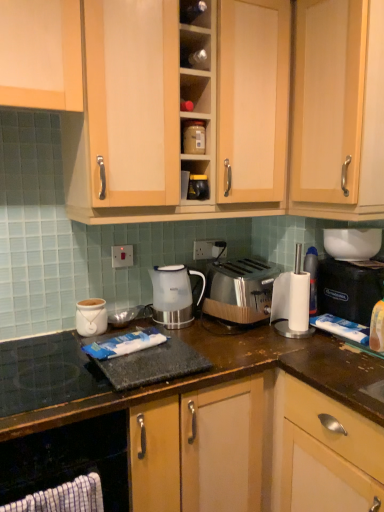
Describe the element at coordinates (69, 459) in the screenshot. I see `black rubber mat at lower left` at that location.

The image size is (384, 512). In order to click on white glossy bowl at upper right, the third appliance viewed from the top in this screenshot , I will do `click(352, 243)`.

The height and width of the screenshot is (512, 384). Describe the element at coordinates (46, 373) in the screenshot. I see `black glass gas stove at lower left` at that location.

How much space does white ceramic jar at center, the fourth appliance when ordered from top to bottom, occupy horizontally?

white ceramic jar at center, the fourth appliance when ordered from top to bottom, is 5.38 inches in width.

In order to face light wood cabinet at upper center, which is the third cabinetry from bottom to top, should I rotate leftwards or rightwards?

You should look left and rotate roughly 1.237 degrees.

The width and height of the screenshot is (384, 512). Describe the element at coordinates (217, 103) in the screenshot. I see `light wood cabinet at upper center, which is the third cabinetry from bottom to top` at that location.

Measure the distance between point (116, 255) and camera.

The depth of point (116, 255) is 5.51 feet.

I want to click on matte plastic container at upper center, the 3th appliance when ordered from right to left, so [x=194, y=137].

Does matte plastic container at upper center, marked as the fourth appliance in a bottom-to-top arrangement, touch black glass gas stove at lower left?

No, matte plastic container at upper center, marked as the fourth appliance in a bottom-to-top arrangement, is not making contact with black glass gas stove at lower left.

Is matte plastic container at upper center, the 3th appliance when ordered from right to left, at the right side of black glass gas stove at lower left?

Indeed, matte plastic container at upper center, the 3th appliance when ordered from right to left, is positioned on the right side of black glass gas stove at lower left.

From a real-world perspective, between matte plastic container at upper center, positioned as the first appliance in top-to-bottom order, and black glass gas stove at lower left, who is vertically lower?

From a 3D spatial view, black glass gas stove at lower left is below.

From the picture: Does matte plastic container at upper center, marked as the fourth appliance in a bottom-to-top arrangement, have a greater width compared to black glass gas stove at lower left?

Incorrect, the width of matte plastic container at upper center, marked as the fourth appliance in a bottom-to-top arrangement, does not surpass that of black glass gas stove at lower left.

Does white ceramic jar at center, the 1th appliance when ordered from bottom to top, turn towards wooden cabinet at lower center, the third cabinetry viewed from the top?

No.

Can you confirm if white ceramic jar at center, the fourth appliance when ordered from top to bottom, is positioned to the right of wooden cabinet at lower center, the third cabinetry viewed from the top?

Incorrect, white ceramic jar at center, the fourth appliance when ordered from top to bottom, is not on the right side of wooden cabinet at lower center, the third cabinetry viewed from the top.

The height and width of the screenshot is (512, 384). Find the location of `appliance that appears on the left of wooden cabinet at lower center, the 1th cabinetry from the bottom`. appliance that appears on the left of wooden cabinet at lower center, the 1th cabinetry from the bottom is located at coordinates (91, 317).

Is white ceramic jar at center, placed as the 1th appliance when sorted from left to right, next to wooden cabinet at lower center, the 1th cabinetry from the bottom, and touching it?

There is a gap between white ceramic jar at center, placed as the 1th appliance when sorted from left to right, and wooden cabinet at lower center, the 1th cabinetry from the bottom.

Considering the sizes of wooden cabinet at lower center, the 1th cabinetry from the bottom, and black glass gas stove at lower left in the image, is wooden cabinet at lower center, the 1th cabinetry from the bottom, bigger or smaller than black glass gas stove at lower left?

wooden cabinet at lower center, the 1th cabinetry from the bottom, is bigger than black glass gas stove at lower left.

Is there a large distance between wooden cabinet at lower center, the third cabinetry viewed from the top, and black glass gas stove at lower left?

That's not correct — wooden cabinet at lower center, the third cabinetry viewed from the top, is a little close to black glass gas stove at lower left.

Could you tell me if wooden cabinet at lower center, the 1th cabinetry from the bottom, is facing black glass gas stove at lower left?

No, wooden cabinet at lower center, the 1th cabinetry from the bottom, is not aimed at black glass gas stove at lower left.

Is black glass gas stove at lower left beside black plastic coffee machine at right?

No, black glass gas stove at lower left is not in contact with black plastic coffee machine at right.

In the scene shown: Considering the sizes of objects black glass gas stove at lower left and black plastic coffee machine at right in the image provided, who is taller, black glass gas stove at lower left or black plastic coffee machine at right?

Standing taller between the two is black plastic coffee machine at right.

What are the coordinates of `gas stove that appears below the black plastic coffee machine at right (from a real-world perspective)` in the screenshot? It's located at (46, 373).

Is black glass gas stove at lower left positioned with its back to black plastic coffee machine at right?

black glass gas stove at lower left does not have its back to black plastic coffee machine at right.

Which object is closer to the camera, light wood cabinet at upper center, which is the third cabinetry from bottom to top, or black plastic coffee machine at right?

light wood cabinet at upper center, which is the third cabinetry from bottom to top.

Is light wood cabinet at upper center, which is the third cabinetry from bottom to top, not within black plastic coffee machine at right?

Yes, light wood cabinet at upper center, which is the third cabinetry from bottom to top, is not within black plastic coffee machine at right.

Is light wood cabinet at upper center, which is the third cabinetry from bottom to top, wider or thinner than black plastic coffee machine at right?

light wood cabinet at upper center, which is the third cabinetry from bottom to top, is wider than black plastic coffee machine at right.

Is light wood cabinet at upper center, which is the first cabinetry from top to bottom, to the left of black plastic coffee machine at right from the viewer's perspective?

Yes.

Considering the relative sizes of black glass gas stove at lower left and black rubber mat at lower left in the image provided, is black glass gas stove at lower left thinner than black rubber mat at lower left?

Yes, black glass gas stove at lower left is thinner than black rubber mat at lower left.

Is black glass gas stove at lower left not close to black rubber mat at lower left?

No, black glass gas stove at lower left is in close proximity to black rubber mat at lower left.

Would you say black glass gas stove at lower left is outside black rubber mat at lower left?

Yes, black glass gas stove at lower left is located beyond the bounds of black rubber mat at lower left.

Which is in front, point (21, 385) or point (29, 469)?

The point (29, 469) is more forward.

Is black plastic coffee machine at right wider than matte plastic container at upper center, the 3th appliance when ordered from right to left?

Yes.

Considering the sizes of objects black plastic coffee machine at right and matte plastic container at upper center, the 3th appliance when ordered from right to left, in the image provided, who is taller, black plastic coffee machine at right or matte plastic container at upper center, the 3th appliance when ordered from right to left,?

Standing taller between the two is black plastic coffee machine at right.

Locate an element on the screen. gas stove in front of the matte plastic container at upper center, marked as the fourth appliance in a bottom-to-top arrangement is located at coordinates (46, 373).

Find the location of a particular element. This screenshot has width=384, height=512. cabinetry directly beneath the white ceramic jar at center, which is counted as the fourth appliance, starting from the right (from a real-world perspective) is located at coordinates (225, 421).

Considering their positions, is black plastic coffee machine at right positioned further to matte plastic container at upper center, positioned as the first appliance in top-to-bottom order, than black rubber mat at lower left?

black rubber mat at lower left.

Based on the photo, looking at the image, which one is located further to satin silver toaster at center, black rubber mat at lower left or black plastic coffee machine at right?

black rubber mat at lower left is positioned further to the anchor satin silver toaster at center.

Estimate the real-world distances between objects in this image. Which object is closer to satin silver toaster at center, white plastic power outlet at center or matte plastic container at upper center, the 3th appliance when ordered from right to left?

white plastic power outlet at center lies closer to satin silver toaster at center than the other object.

Estimate the real-world distances between objects in this image. Which object is further from satin silver toaster at center, black rubber mat at lower left or light wood cabinet at upper right, the second cabinetry when ordered from top to bottom?

black rubber mat at lower left is positioned further to the anchor satin silver toaster at center.

From the image, which object appears to be farther from light wood cabinet at upper right, the second cabinetry when ordered from top to bottom, white ceramic jar at center, the fourth appliance when ordered from top to bottom, or light wood cabinet at upper center, which is the first cabinetry from top to bottom?

white ceramic jar at center, the fourth appliance when ordered from top to bottom, is further to light wood cabinet at upper right, the second cabinetry when ordered from top to bottom.

Which object lies further to the anchor point black plastic coffee machine at right, wooden cabinet at lower center, the 1th cabinetry from the bottom, or white glossy bowl at upper right, the 4th appliance from the left?

Among the two, wooden cabinet at lower center, the 1th cabinetry from the bottom, is located further to black plastic coffee machine at right.

Estimate the real-world distances between objects in this image. Which object is closer to white glossy electric kettle at center, matte black jar at center, placed as the 2th appliance when sorted from right to left, or white glossy bowl at upper right, which appears as the second appliance when ordered from the bottom?

matte black jar at center, placed as the 2th appliance when sorted from right to left.

When comparing their distances from white glossy electric kettle at center, does white glossy bowl at upper right, arranged as the first appliance when viewed from the right, or black glass gas stove at lower left seem further?

white glossy bowl at upper right, arranged as the first appliance when viewed from the right, lies further to white glossy electric kettle at center than the other object.

At what (x,y) coordinates should I click in order to perform the action: click on electric outlet between matte plastic container at upper center, arranged as the 2th appliance when viewed from the left, and white plastic power outlet at center vertically. Please return your answer as a coordinate pair (x, y). This screenshot has width=384, height=512. Looking at the image, I should click on (209, 249).

Find the location of a particular element. The height and width of the screenshot is (512, 384). cabinetry between light wood cabinet at upper center, which is the third cabinetry from bottom to top, and white glossy electric kettle at center vertically is located at coordinates (338, 108).

Locate an element on the screen. This screenshot has width=384, height=512. kitchen appliance between light wood cabinet at upper center, which is the first cabinetry from top to bottom, and black glass gas stove at lower left from top to bottom is located at coordinates (174, 295).

The width and height of the screenshot is (384, 512). I want to click on gas stove between wooden cabinet at lower center, the 1th cabinetry from the bottom, and white glossy electric kettle at center, along the z-axis, so click(46, 373).